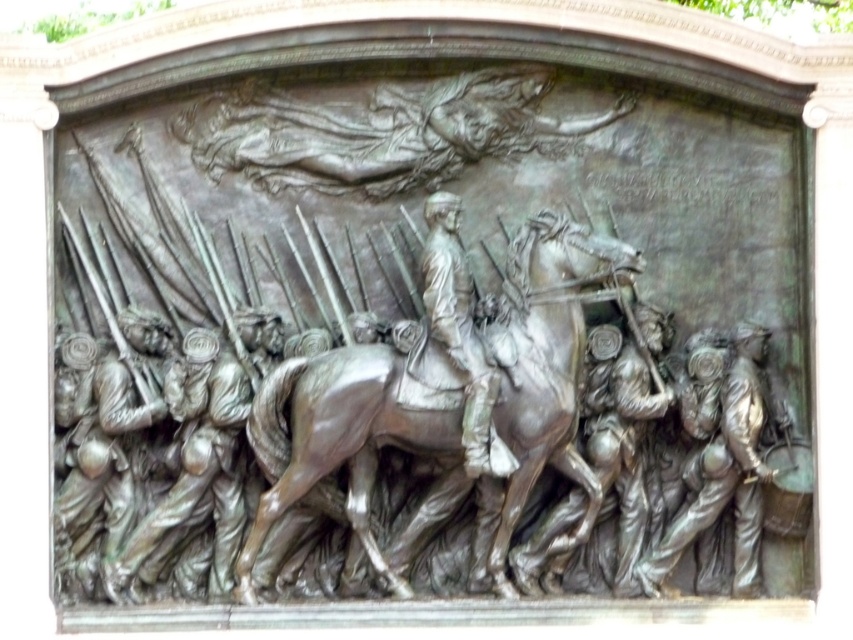
In the scene shown: Does shiny bronze horse at center have a greater width compared to bronze figure at center?

Yes.

Is shiny bronze horse at center positioned behind bronze figure at center?

Yes, it is.

Is point (596, 298) positioned in front of point (454, 326)?

No.

You are a GUI agent. You are given a task and a screenshot of the screen. Output one action in this format:
    pyautogui.click(x=<x>, y=<y>)
    Task: Click on the shiny bronze horse at center
    
    Given the screenshot: What is the action you would take?
    pyautogui.click(x=352, y=433)